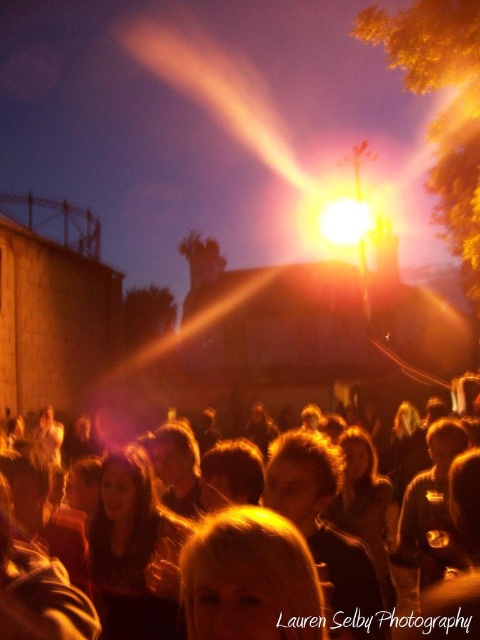
Question: Is matte golden hair at center positioned before bright yellow light at center?

Choices:
 (A) no
 (B) yes

Answer: (B)

Question: Which object appears closest to the camera in this image?

Choices:
 (A) matte golden hair at center
 (B) bright yellow light at center

Answer: (A)

Question: Which of the following is the farthest from the observer?

Choices:
 (A) matte golden hair at center
 (B) bright yellow light at center

Answer: (B)

Question: Where is matte golden hair at center located in relation to bright yellow light at center in the image?

Choices:
 (A) below
 (B) above

Answer: (A)

Question: Does matte golden hair at center have a greater width compared to bright yellow light at center?

Choices:
 (A) no
 (B) yes

Answer: (B)